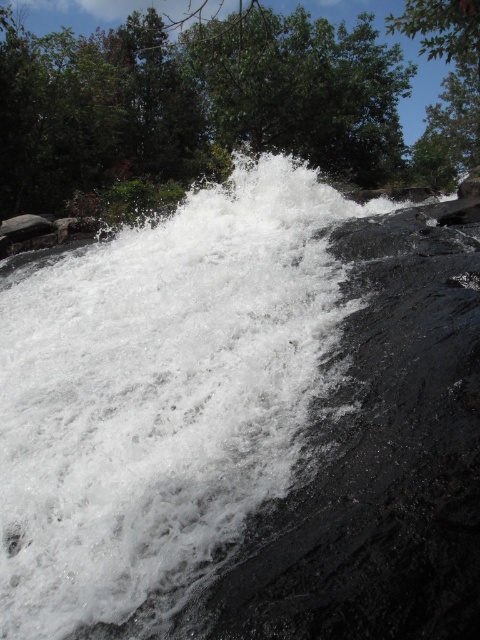
Between white frothy water at center and green leafy tree at upper center, which one is positioned lower?

Positioned lower is white frothy water at center.

Can you confirm if white frothy water at center is positioned to the left of green leafy tree at upper center?

In fact, white frothy water at center is to the right of green leafy tree at upper center.

Where is `white frothy water at center`? This screenshot has width=480, height=640. white frothy water at center is located at coordinates pyautogui.click(x=160, y=397).